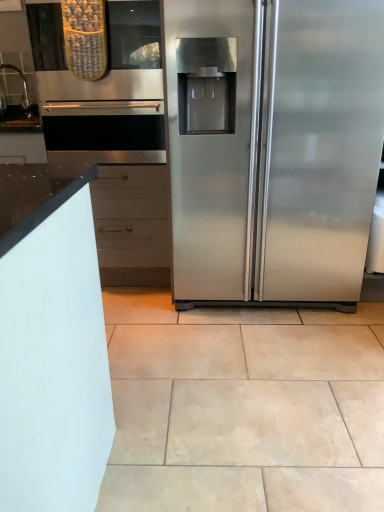
Find the location of `vacant region in front of stainless steel refrigerator at right`. vacant region in front of stainless steel refrigerator at right is located at coordinates (274, 364).